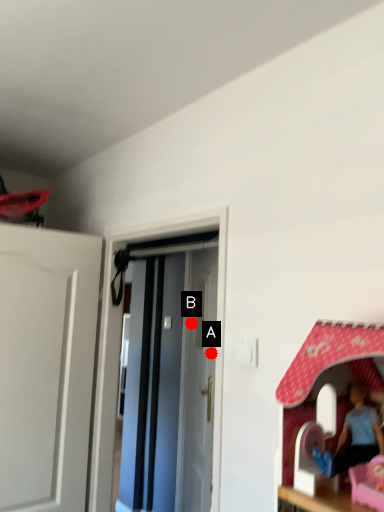
Question: Two points are circled on the image, labeled by A and B beside each circle. Which of the following is the closest to the observer?

Choices:
 (A) A is closer
 (B) B is closer

Answer: (A)